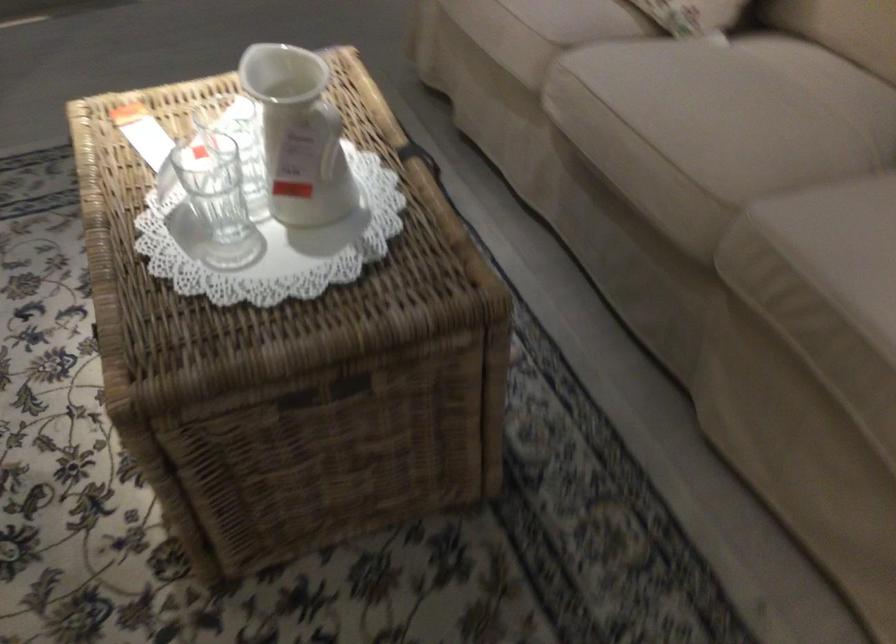
The width and height of the screenshot is (896, 644). I want to click on sofa sitting surface, so click(x=704, y=167).